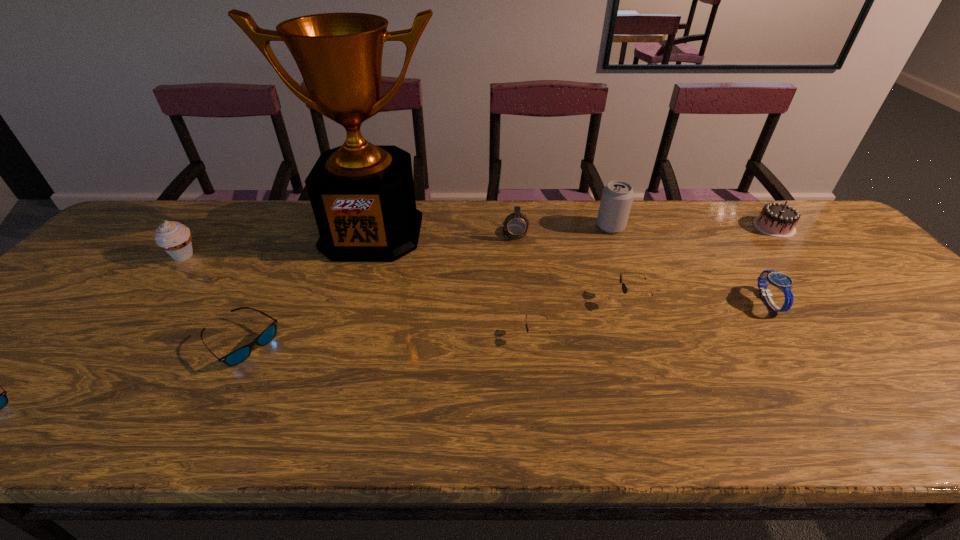
Locate an element on the screen. The width and height of the screenshot is (960, 540). free point between the rightmost sunglasses and the blue watch is located at coordinates (700, 301).

This screenshot has height=540, width=960. I want to click on free point between the left black sunglasses and the can, so click(x=573, y=281).

Image resolution: width=960 pixels, height=540 pixels. I want to click on unoccupied area between the ninth object from left to right and the gold trophy cup, so click(x=570, y=267).

This screenshot has width=960, height=540. Identify the location of object that is the closest to the compass. (362, 195).

Locate an element on the screen. the fourth closest object to the second tallest sunglasses is located at coordinates (617, 196).

Point out which sunglasses is positioned as the third nearest to the watch. Please provide its 2D coordinates. Your answer should be formatted as a tuple, i.e. [(x, y)], where the tuple contains the x and y coordinates of a point satisfying the conditions above.

[(236, 357)]

What are the coordinates of `sunglasses that is the third closest one to the ninth object from left to right` in the screenshot? It's located at coord(236,357).

You are a GUI agent. You are given a task and a screenshot of the screen. Output one action in this format:
    pyautogui.click(x=<x>, y=<y>)
    Task: Click on the vacant region that satisfies the following two spatial constraints: 1. on the back side of the rightmost object; 2. on the right side of the second object from left to right
    
    Given the screenshot: What is the action you would take?
    pyautogui.click(x=207, y=227)